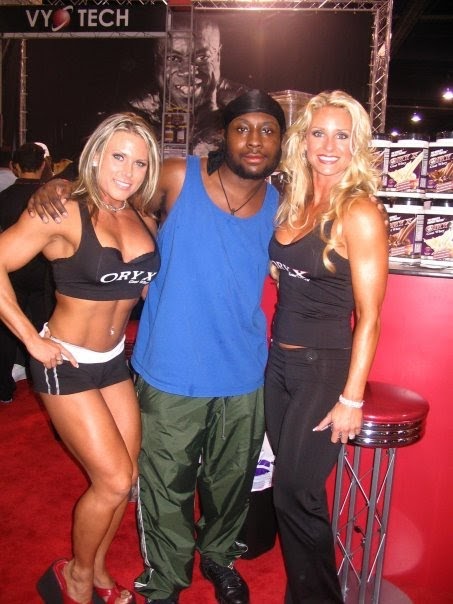
Identify the location of the top of stool. (395, 394).